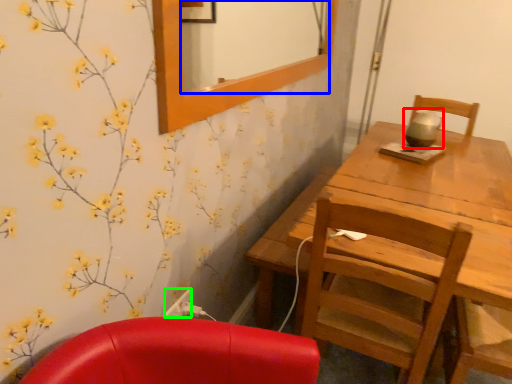
Question: Which is nearer to the tea pot (highlighted by a red box)? mirror (highlighted by a blue box) or power outlet (highlighted by a green box).

Choices:
 (A) mirror
 (B) power outlet

Answer: (B)